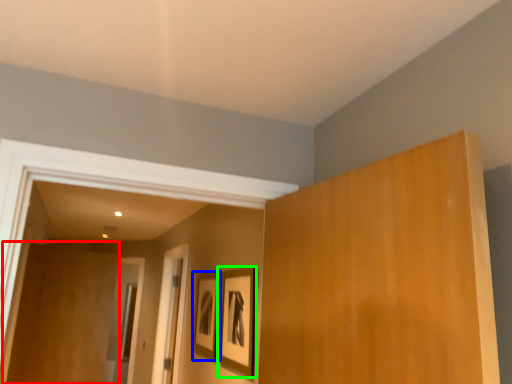
Question: Estimate the real-world distances between objects in this image. Which object is farther from plywood (highlighted by a red box), picture frame (highlighted by a blue box) or picture frame (highlighted by a green box)?

Choices:
 (A) picture frame
 (B) picture frame

Answer: (B)